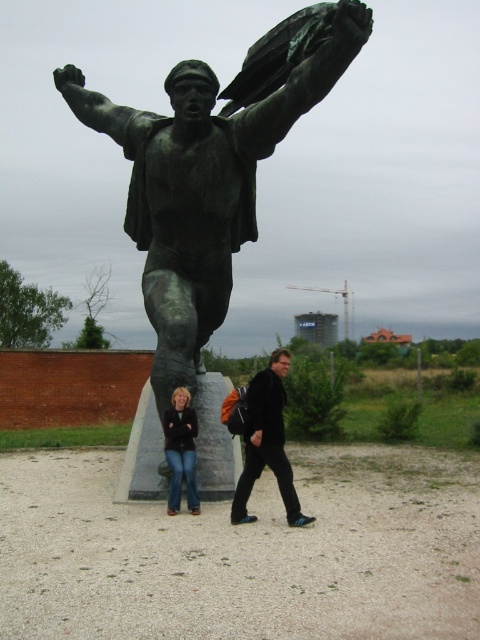
Does point (253, 433) come farther from viewer compared to point (168, 509)?

No, (253, 433) is in front of (168, 509).

What do you see at coordinates (266, 442) in the screenshot? I see `black matte jacket at center` at bounding box center [266, 442].

Who is more forward, (247, 490) or (171, 422)?

Positioned in front is point (247, 490).

The image size is (480, 640). I want to click on black matte jacket at center, so click(x=266, y=442).

Between bronze statue at center and denim jeans at lower left, which one is positioned higher?

bronze statue at center is higher up.

Is bronze statue at center behind denim jeans at lower left?

No, it is not.

Who is more forward, (348, 52) or (191, 470)?

Point (348, 52) is more forward.

Find the location of a particular element. Image resolution: width=480 pixels, height=640 pixels. bronze statue at center is located at coordinates (202, 186).

Image resolution: width=480 pixels, height=640 pixels. Describe the element at coordinates (202, 186) in the screenshot. I see `bronze statue at center` at that location.

Who is positioned more to the left, bronze statue at center or black matte jacket at center?

From the viewer's perspective, bronze statue at center appears more on the left side.

The height and width of the screenshot is (640, 480). What do you see at coordinates (202, 186) in the screenshot? I see `bronze statue at center` at bounding box center [202, 186].

Identify the location of bronze statue at center. (202, 186).